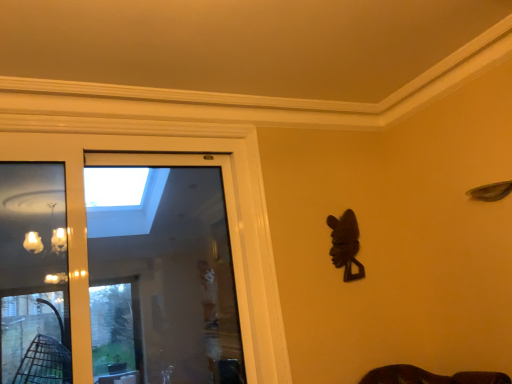
Question: Is dark brown wood mask at right outside of transparent glass screen door at center?

Choices:
 (A) yes
 (B) no

Answer: (A)

Question: Is dark brown wood mask at right facing towards transparent glass screen door at center?

Choices:
 (A) yes
 (B) no

Answer: (B)

Question: From a real-world perspective, is dark brown wood mask at right located higher than transparent glass screen door at center?

Choices:
 (A) no
 (B) yes

Answer: (B)

Question: Would you say dark brown wood mask at right contains transparent glass screen door at center?

Choices:
 (A) yes
 (B) no

Answer: (B)

Question: Does dark brown wood mask at right appear on the right side of transparent glass screen door at center?

Choices:
 (A) yes
 (B) no

Answer: (A)

Question: Is dark brown wood mask at right smaller than transparent glass screen door at center?

Choices:
 (A) no
 (B) yes

Answer: (B)

Question: Considering the relative positions of transparent glass screen door at center and dark brown wood mask at right in the image provided, is transparent glass screen door at center to the left of dark brown wood mask at right from the viewer's perspective?

Choices:
 (A) no
 (B) yes

Answer: (B)

Question: Can you confirm if transparent glass screen door at center is shorter than dark brown wood mask at right?

Choices:
 (A) yes
 (B) no

Answer: (B)

Question: Considering the relative sizes of transparent glass screen door at center and dark brown wood mask at right in the image provided, is transparent glass screen door at center taller than dark brown wood mask at right?

Choices:
 (A) no
 (B) yes

Answer: (B)

Question: Is transparent glass screen door at center far from dark brown wood mask at right?

Choices:
 (A) yes
 (B) no

Answer: (A)

Question: Considering the relative positions of transparent glass screen door at center and dark brown wood mask at right in the image provided, is transparent glass screen door at center to the right of dark brown wood mask at right from the viewer's perspective?

Choices:
 (A) yes
 (B) no

Answer: (B)

Question: Is transparent glass screen door at center outside of dark brown wood mask at right?

Choices:
 (A) no
 (B) yes

Answer: (B)

Question: Considering the relative positions of transparent glass screen door at center and dark brown wood mask at right in the image provided, is transparent glass screen door at center to the left or to the right of dark brown wood mask at right?

Choices:
 (A) left
 (B) right

Answer: (A)